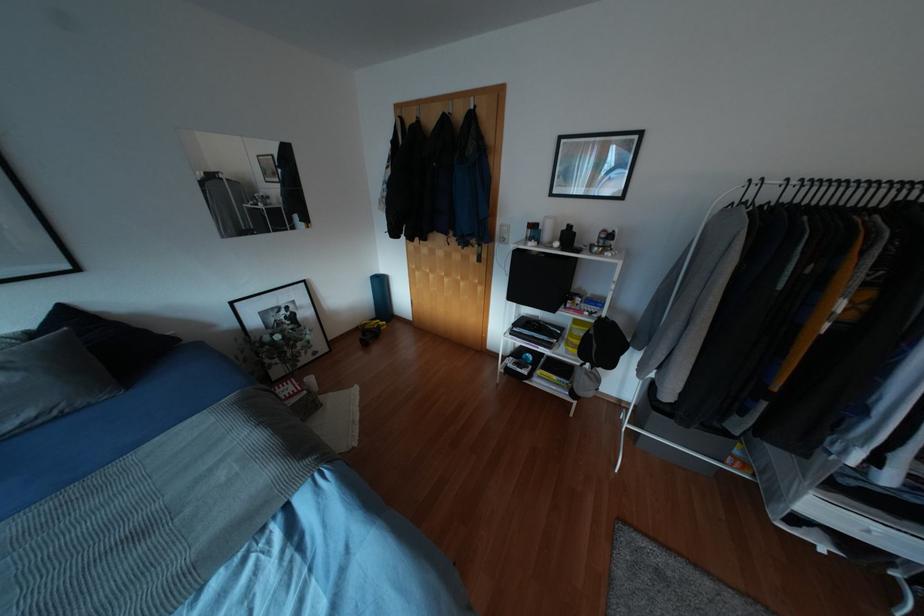
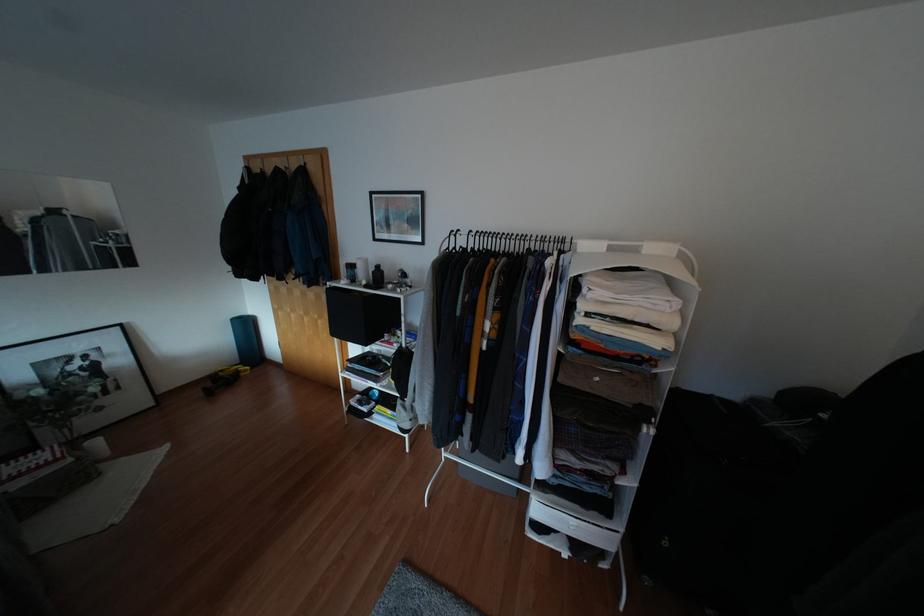
Find the pixel in the second image that matches the point at 568,225 in the first image.

(377, 265)